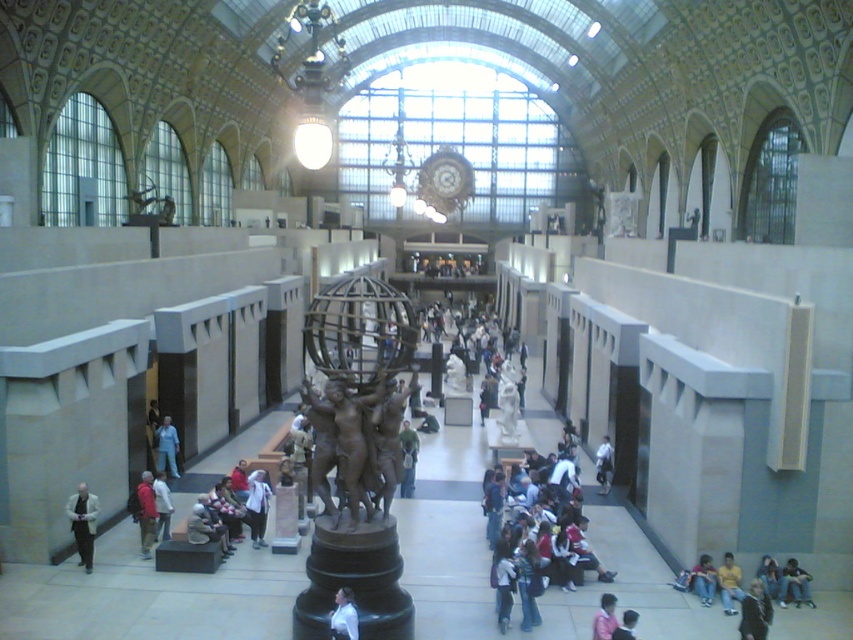
Can you confirm if bronze statue at center is thinner than dark brown suit at center?

Incorrect, bronze statue at center's width is not less than dark brown suit at center's.

Does point (326, 403) lie behind point (750, 593)?

That is False.

I want to click on bronze statue at center, so click(344, 435).

Locate an element on the screen. light gray fabric jacket at lower left is located at coordinates (161, 506).

Who is more distant from viewer, (158,474) or (602,438)?

Positioned behind is point (602,438).

I want to click on light gray fabric jacket at lower left, so click(161, 506).

Does dark blue jeans at lower center have a greater height compared to light blue denim jacket at lower right?

Indeed, dark blue jeans at lower center has a greater height compared to light blue denim jacket at lower right.

Consider the image. Between dark blue jeans at lower center and light blue denim jacket at lower right, which one appears on the left side from the viewer's perspective?

dark blue jeans at lower center

Image resolution: width=853 pixels, height=640 pixels. I want to click on dark blue jeans at lower center, so click(548, 540).